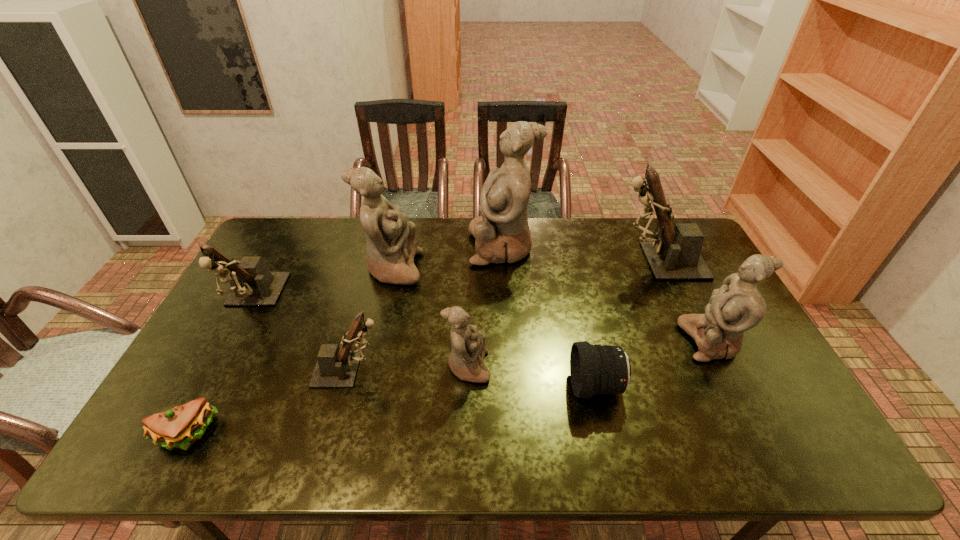
Locate an element on the screen. The image size is (960, 540). vacant space located on the front-facing side of the rightmost brown figurine is located at coordinates (563, 261).

Find the location of a particular element. This screenshot has width=960, height=540. vacant space located 0.370m on the front-facing side of the leftmost brown figurine is located at coordinates tap(170, 454).

Where is `free spot located on the front-facing side of the rightmost white figurine`? free spot located on the front-facing side of the rightmost white figurine is located at coordinates (622, 341).

Locate an element on the screen. vacant space situated 0.070m on the front-facing side of the rightmost white figurine is located at coordinates (658, 341).

Locate an element on the screen. The height and width of the screenshot is (540, 960). vacant area situated on the front-facing side of the rightmost white figurine is located at coordinates (565, 341).

I want to click on free space located on the front-facing side of the smallest white figurine, so click(594, 367).

Where is `blank space located 0.260m on the front-facing side of the second brown figurine from left to right`? The width and height of the screenshot is (960, 540). blank space located 0.260m on the front-facing side of the second brown figurine from left to right is located at coordinates (483, 369).

Identify the location of free space located 0.390m at the front element of the telephoto lens. Image resolution: width=960 pixels, height=540 pixels. (420, 386).

Locate an element on the screen. This screenshot has width=960, height=540. vacant space located at the front element of the telephoto lens is located at coordinates (509, 386).

At what (x,y) coordinates should I click in order to perform the action: click on vacant area situated at the front element of the telephoto lens. Please return your answer as a coordinate pair (x, y). Looking at the image, I should click on (423, 386).